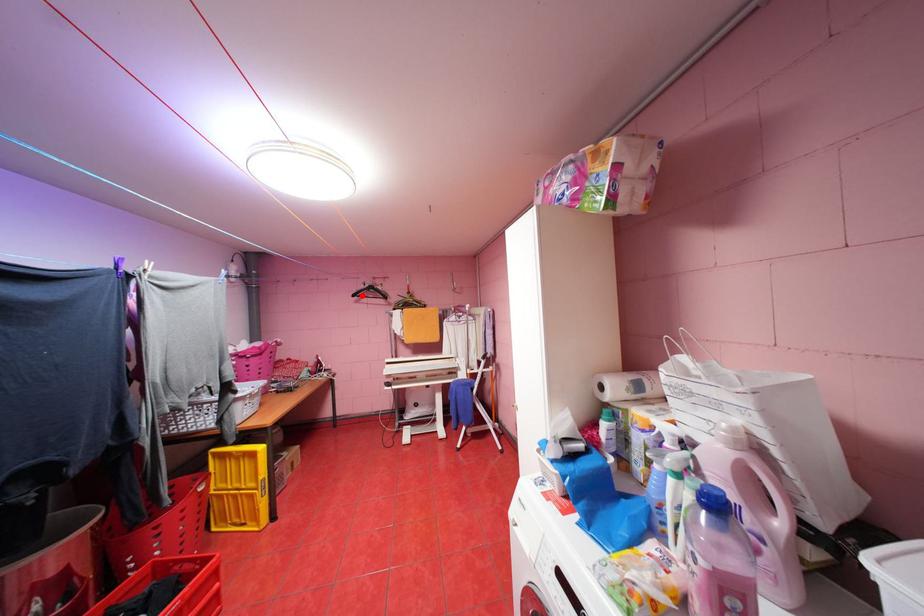
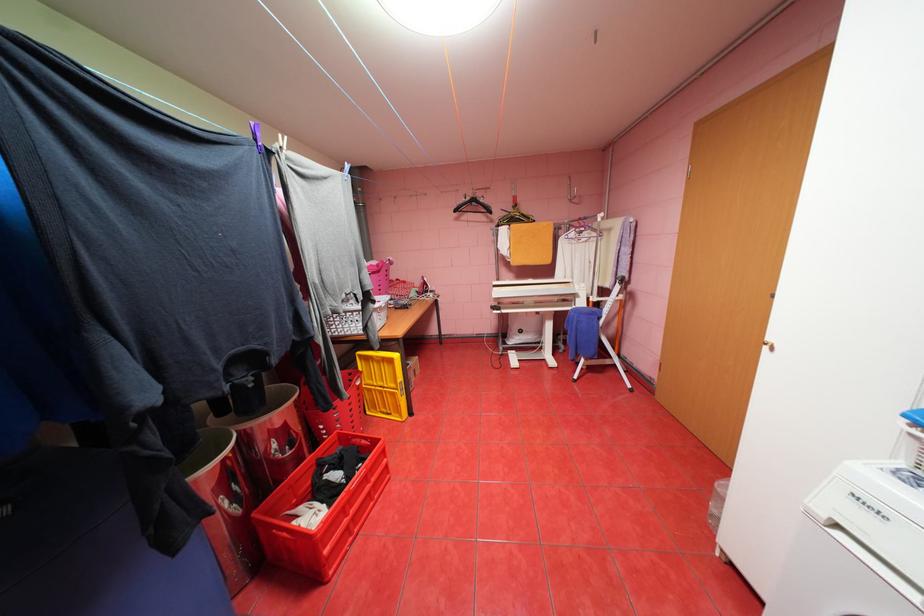
Find the pixel in the second image that matches the highlighted location in the first image.

(464, 209)